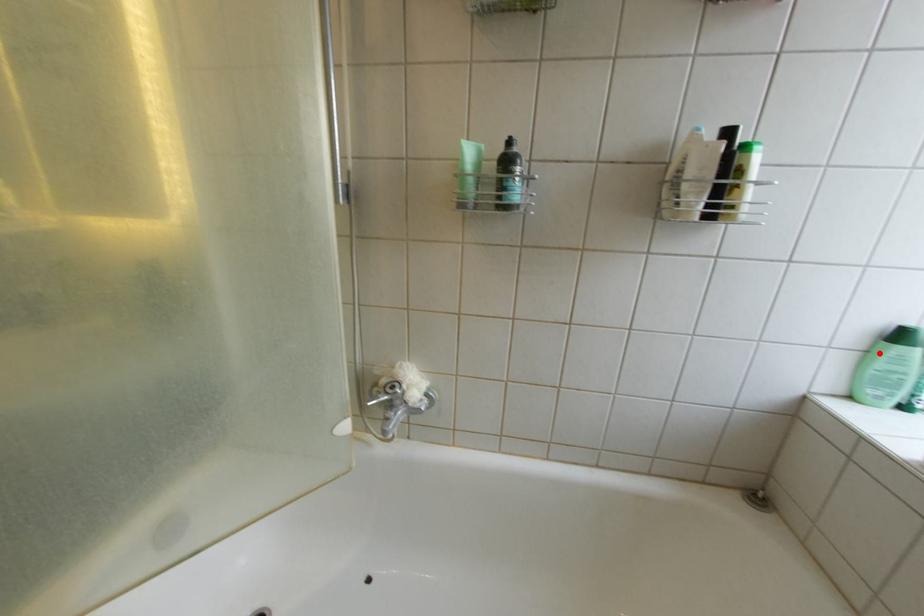
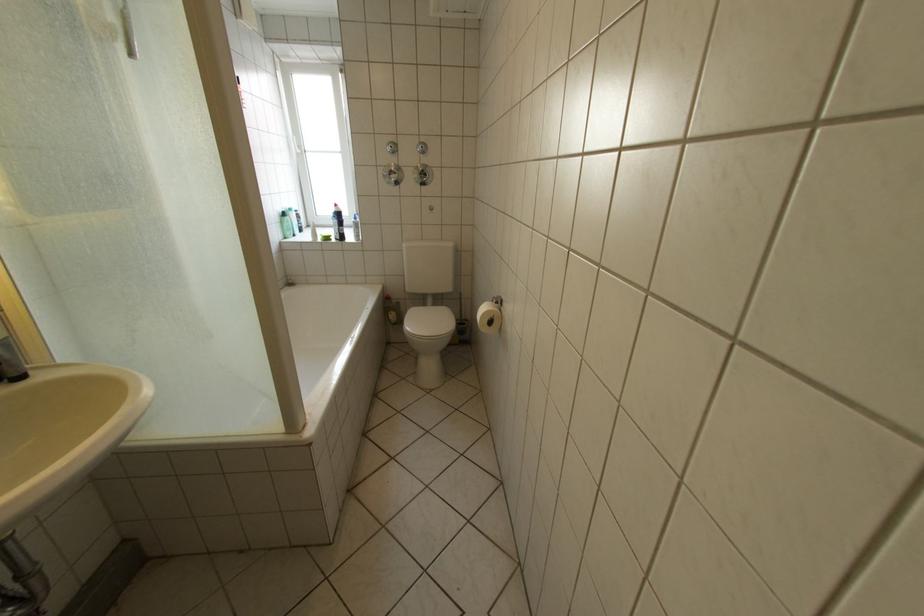
Locate, in the second image, the point that corresponds to the highlighted location in the first image.

(294, 224)